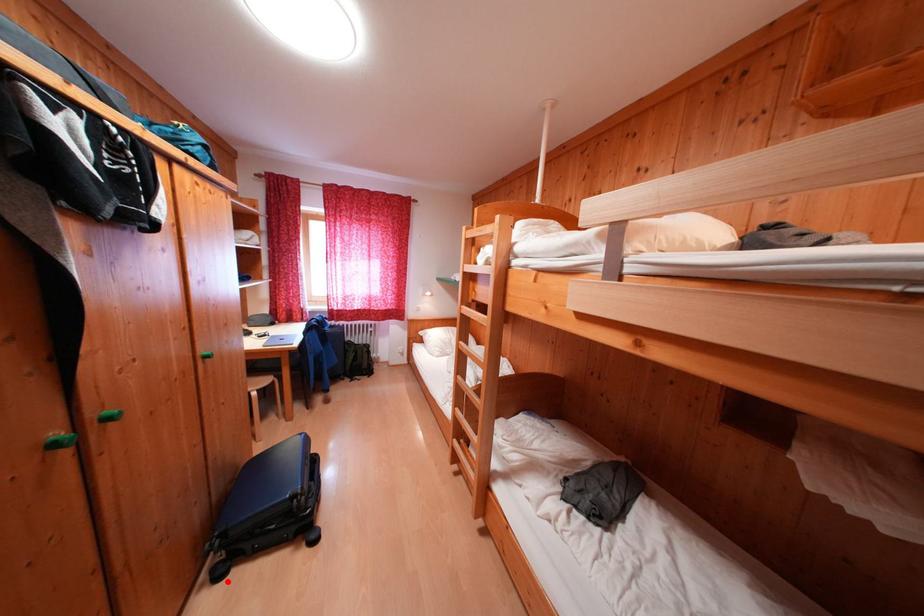
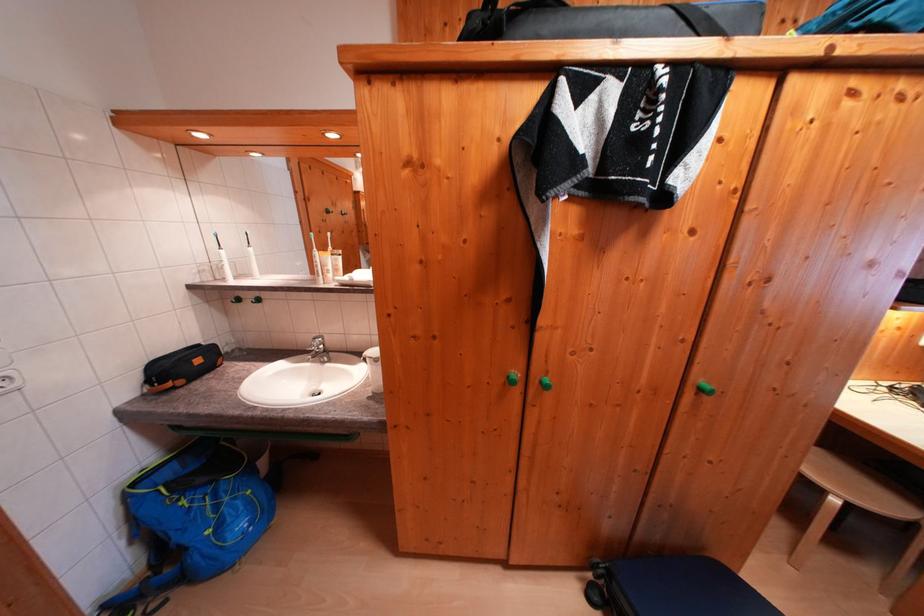
Locate, in the second image, the point that corresponds to the highlighted location in the first image.

(598, 602)